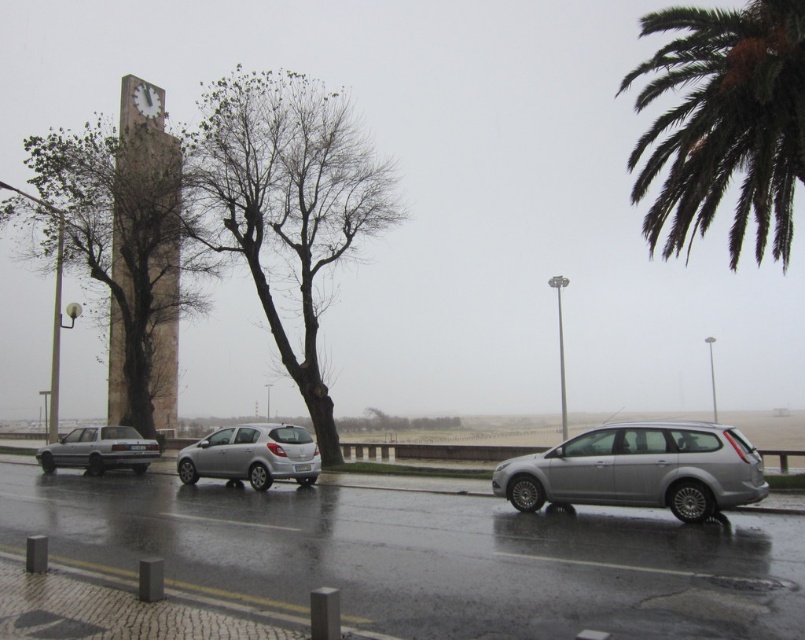
Question: Where is green leafy palm tree at upper right located in relation to silver metallic station wagon at center-right in the image?

Choices:
 (A) left
 (B) right

Answer: (B)

Question: Considering the relative positions of green leafy palm tree at upper right and brown rough tree at left in the image provided, where is green leafy palm tree at upper right located with respect to brown rough tree at left?

Choices:
 (A) above
 (B) below

Answer: (A)

Question: Based on their relative distances, which object is farther from the brown rough tree at left?

Choices:
 (A) silver metallic sedan at center
 (B) satin silver hatchback at center
 (C) silver metallic station wagon at center-right

Answer: (C)

Question: Which of the following is the closest to the observer?

Choices:
 (A) bare wood tree at center
 (B) brown rough tree at left
 (C) green leafy palm tree at upper right
 (D) silver metallic station wagon at center-right

Answer: (D)

Question: Does green leafy palm tree at upper right have a larger size compared to silver metallic sedan at center?

Choices:
 (A) no
 (B) yes

Answer: (B)

Question: Which point is farther from the camera taking this photo?

Choices:
 (A) (161, 364)
 (B) (795, 157)
 (C) (85, 445)
 (D) (331, 120)

Answer: (A)